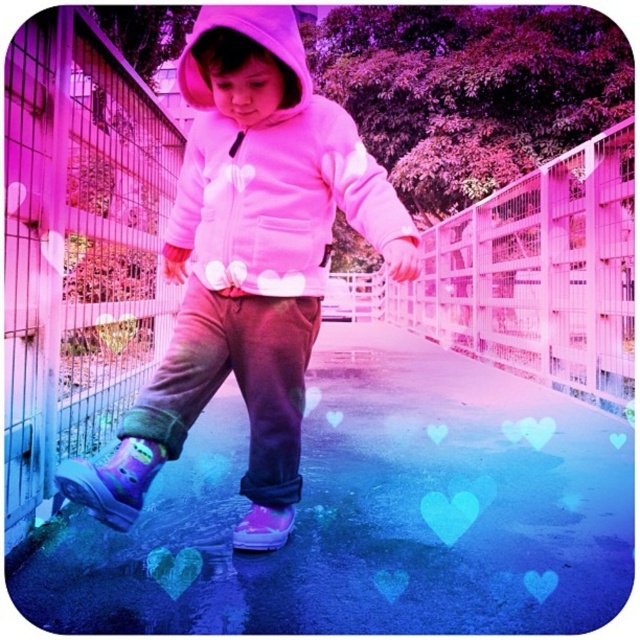
Who is taller, white wire fence at center or light purple rubber boot at lower left?

light purple rubber boot at lower left is taller.

Between white wire fence at center and light purple rubber boot at lower left, which one appears on the left side from the viewer's perspective?

light purple rubber boot at lower left

Identify the location of white wire fence at center. coord(538,275).

Find the location of `white wire fence at center`. white wire fence at center is located at coordinates (538, 275).

Is point (106, 129) farther from camera compared to point (278, 513)?

Yes.

Which of these two, metallic wire fence at left or purple rubber boot at lower center, stands taller?

metallic wire fence at left

Who is more distant from viewer, (113,241) or (262,515)?

Point (113,241)

Identify the location of metallic wire fence at left. Image resolution: width=640 pixels, height=640 pixels. (77, 248).

Who is lower down, pink fleece hoodie at center or purple rubber boot at lower center?

purple rubber boot at lower center is below.

Which of these two, pink fleece hoodie at center or purple rubber boot at lower center, stands taller?

With more height is pink fleece hoodie at center.

Where is `pink fleece hoodie at center`? This screenshot has width=640, height=640. pink fleece hoodie at center is located at coordinates (248, 256).